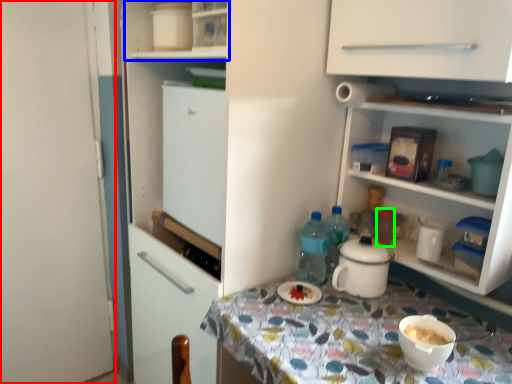
Question: Which is farther away from door (highlighted by a red box)? cabinet (highlighted by a blue box) or bottle (highlighted by a green box)?

Choices:
 (A) cabinet
 (B) bottle

Answer: (B)